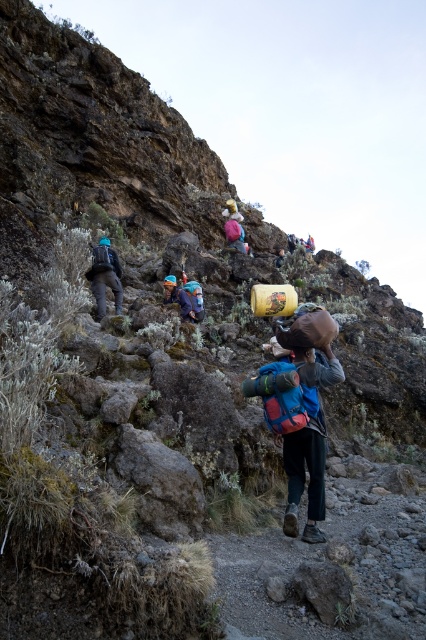
You are a hiker planning to place a small first aid kit on the trail. The trail is narrow and rocky. The point marked at coordinates (235,230) is where you want to place it. However, there is an object already there. What object is located at that point?

The point at coordinates (235,230) has a matte pink backpack at center placed there.

You are a hiker planning to carry both the matte black backpack at left and the matte pink backpack at center up the mountain. Given the rugged terrain and your physical capacity, which backpack is more suitable to carry first considering its size?

The matte black backpack at left is larger in size compared to the matte pink backpack at center, so it would be more physically demanding to carry first. It might be advisable to start with the smaller matte pink backpack at center to conserve energy for the challenging mountain trail.